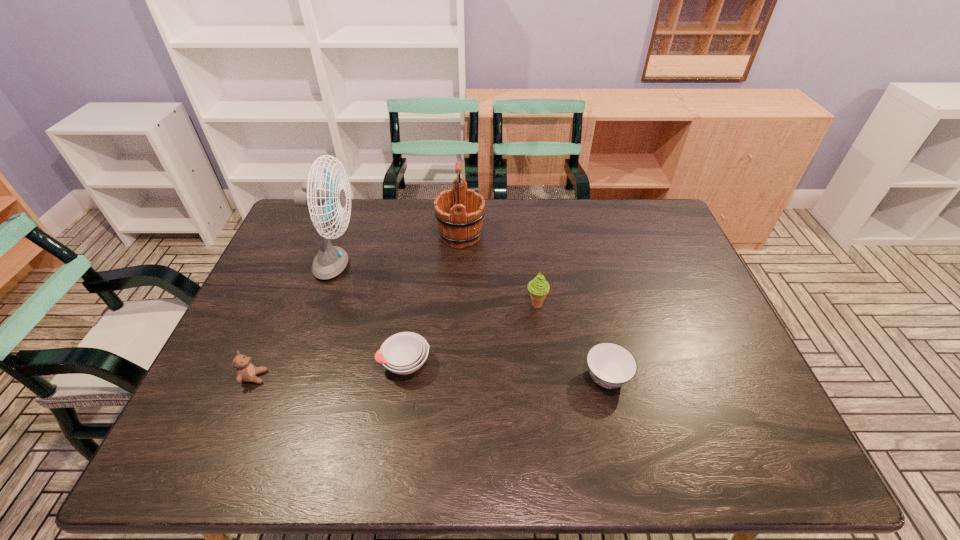
At what (x,y) coordinates should I click in order to perform the action: click on free space between the leftmost object and the fan. Please return your answer as a coordinate pair (x, y). Looking at the image, I should click on (296, 322).

The height and width of the screenshot is (540, 960). I want to click on vacant point located between the rightmost object and the fourth nearest object, so click(x=571, y=341).

The image size is (960, 540). I want to click on free space between the left soup bowl and the icecream, so click(470, 334).

Identify the location of free spot between the rightmost object and the leftmost object. (430, 377).

Where is `object that is the third closest one to the second object from right to left`? This screenshot has height=540, width=960. object that is the third closest one to the second object from right to left is located at coordinates (403, 353).

Point out which object is positioned as the nearest to the rightmost object. Please provide its 2D coordinates. Your answer should be formatted as a tuple, i.e. [(x, y)], where the tuple contains the x and y coordinates of a point satisfying the conditions above.

[(538, 287)]

The height and width of the screenshot is (540, 960). Identify the location of free location that satisfies the following two spatial constraints: 1. on the front side of the rightmost object; 2. on the left side of the left soup bowl. (402, 377).

Where is `vacant space that satisfies the following two spatial constraints: 1. on the front-facing side of the rightmost object; 2. on the right side of the third shortest object`? The image size is (960, 540). vacant space that satisfies the following two spatial constraints: 1. on the front-facing side of the rightmost object; 2. on the right side of the third shortest object is located at coordinates (253, 377).

The image size is (960, 540). I want to click on free space that satisfies the following two spatial constraints: 1. on the front-facing side of the teddy bear; 2. on the back side of the rightmost object, so pyautogui.click(x=253, y=377).

Identify the location of vacant space that satisfies the following two spatial constraints: 1. on the front side of the fifth shortest object; 2. on the front-facing side of the leftmost object. (453, 377).